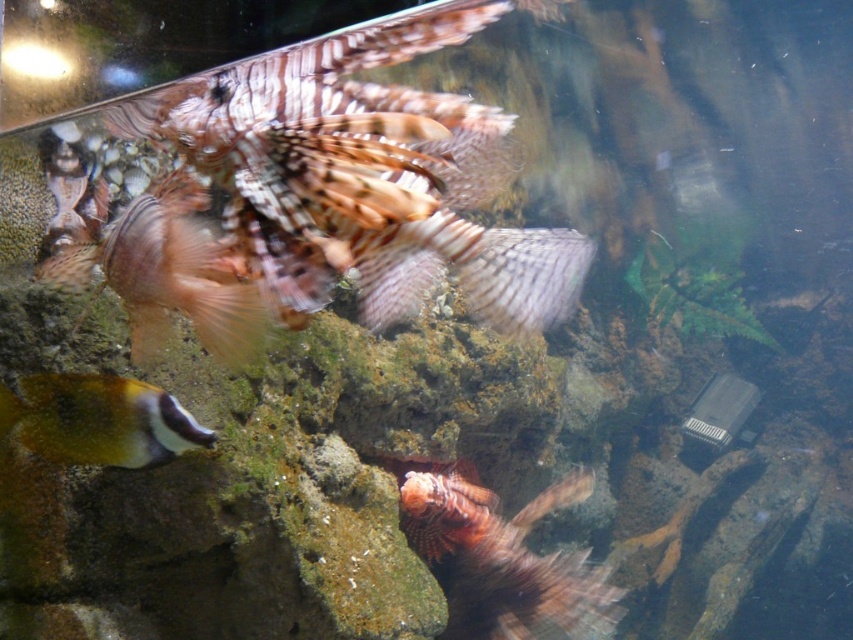
You are a marine biologist observing the underwater scene. You notice the multicolored feathery fish at upper left and the speckled yellow fish at lower left. Which fish is positioned higher in the water column?

The multicolored feathery fish at upper left is positioned higher in the water column than the speckled yellow fish at lower left.

You are a marine biologist observing an underwater scene in an aquarium. You notice a point marked at coordinates (364, 177). What type of fish is located at this point?

The point (364, 177) indicates a speckled brown fish at center.

You are a marine biologist observing an underwater scene in an aquarium. You notice a lionfish near a rocky structure. There is also a point marked at coordinates (169, 273). What is located at that point?

At point (169, 273) lies multicolored feathery fish at upper left.